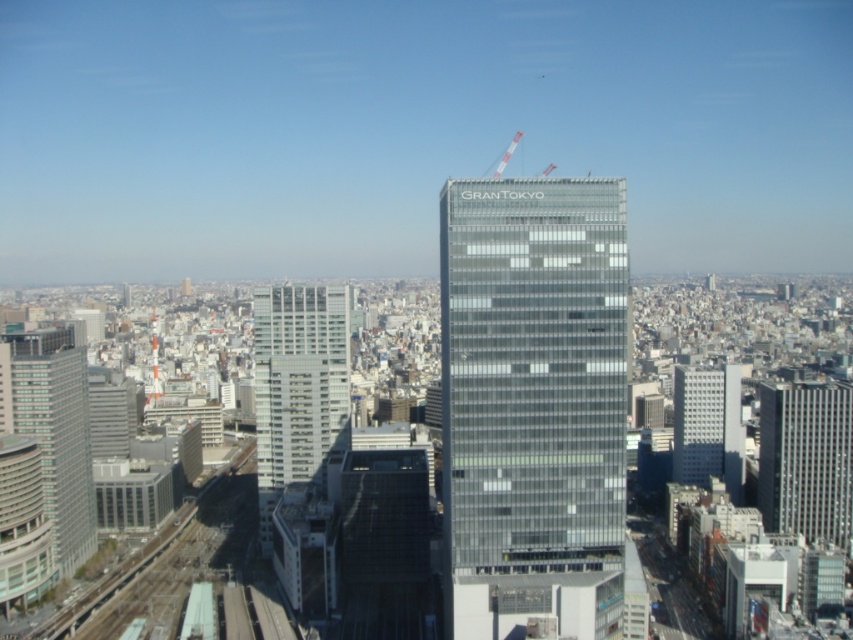
You are a city planner reviewing the urban layout. From your current vantage point, which building would block the view of the gray concrete building at right when looking towards the glassy reflective building at center?

The glassy reflective building at center is in front of the gray concrete building at right, so it would block the view of the gray concrete building at right.

You are a city planner assessing the skyline. You need to determine if the silver metallic building at right can be seen from the observation deck of the white metallic crane at upper center. Based on their heights, can you confirm visibility?

The silver metallic building at right has a lesser height compared to the white metallic crane at upper center. Since the crane is taller, it would block the view of the silver metallic building at right from its observation deck.